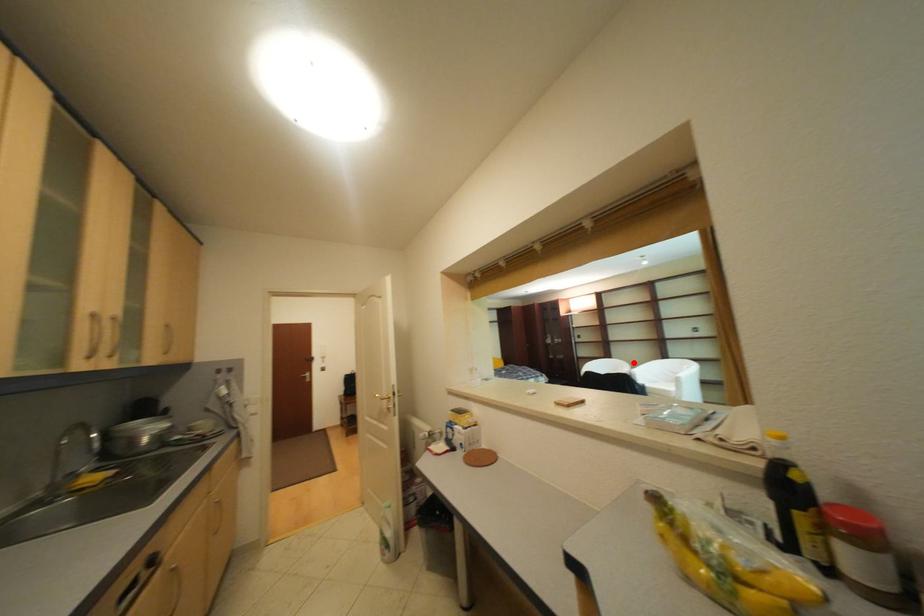
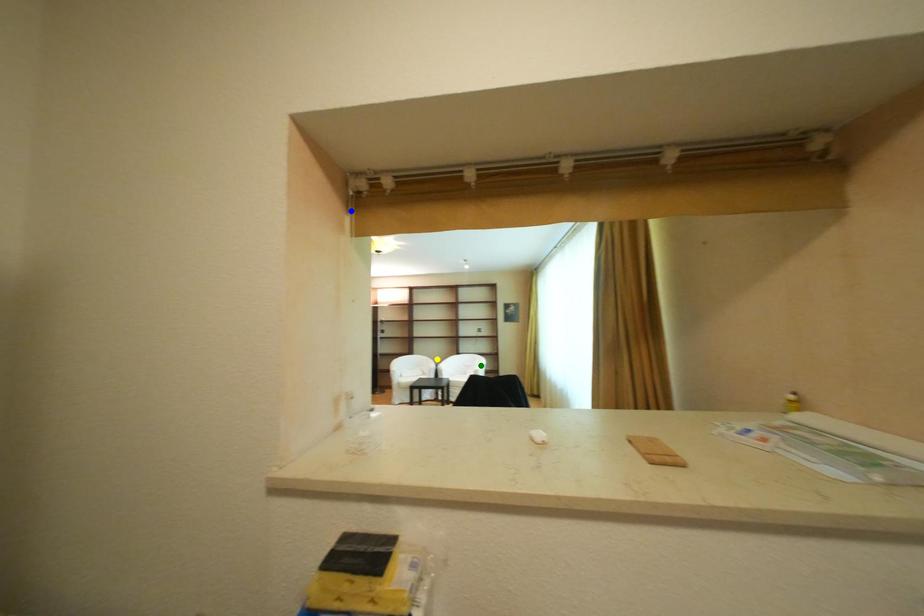
Question: I am providing you with two images of the same scene from different viewpoints. A red point is marked on the first image. You are given multiple points on the second image. Which point in image 2 is actually the same real-world point as the red point in image 1?

Choices:
 (A) green point
 (B) blue point
 (C) yellow point

Answer: (C)